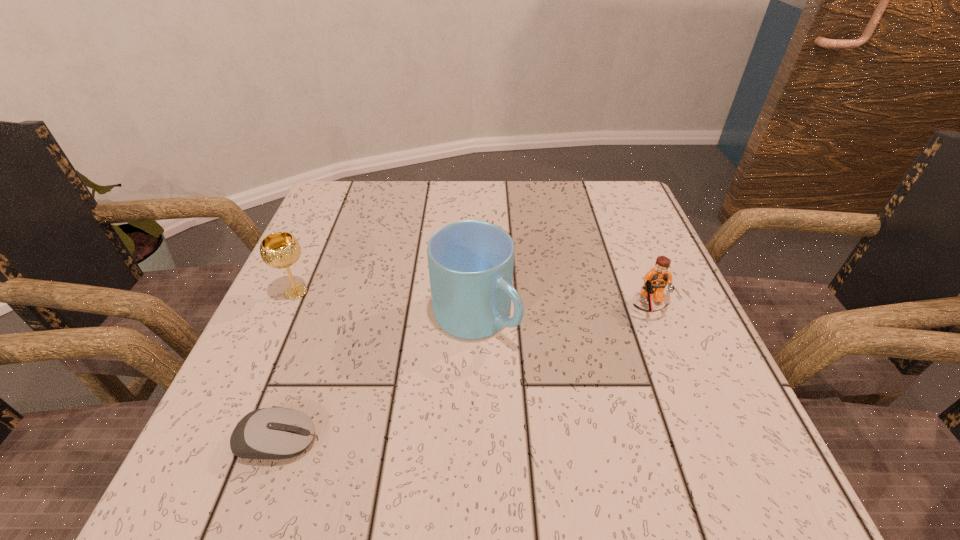
In the image, there is a desktop. Where is `vacant space at the far left corner`? The width and height of the screenshot is (960, 540). vacant space at the far left corner is located at coordinates (380, 202).

In order to click on vacant area at the far right corner of the desktop in this screenshot , I will do point(637,211).

At what (x,y) coordinates should I click in order to perform the action: click on vacant point at the near right corner. Please return your answer as a coordinate pair (x, y). The height and width of the screenshot is (540, 960). Looking at the image, I should click on (681, 485).

The image size is (960, 540). I want to click on free space between the second object from right to left and the third shortest object, so click(x=386, y=305).

I want to click on vacant space that's between the computer equipment and the chalice, so click(x=286, y=367).

Locate an element on the screen. unoccupied position between the shortest object and the rightmost object is located at coordinates (463, 374).

Find the location of a particular element. The height and width of the screenshot is (540, 960). empty space between the mug and the second shortest object is located at coordinates [x=563, y=312].

The height and width of the screenshot is (540, 960). Find the location of `free point between the second tallest object and the shortest object`. free point between the second tallest object and the shortest object is located at coordinates (286, 367).

Locate an element on the screen. Image resolution: width=960 pixels, height=540 pixels. vacant area that lies between the mug and the third tallest object is located at coordinates (563, 312).

Where is `free space that is in between the third tallest object and the shortest object`? This screenshot has height=540, width=960. free space that is in between the third tallest object and the shortest object is located at coordinates (463, 374).